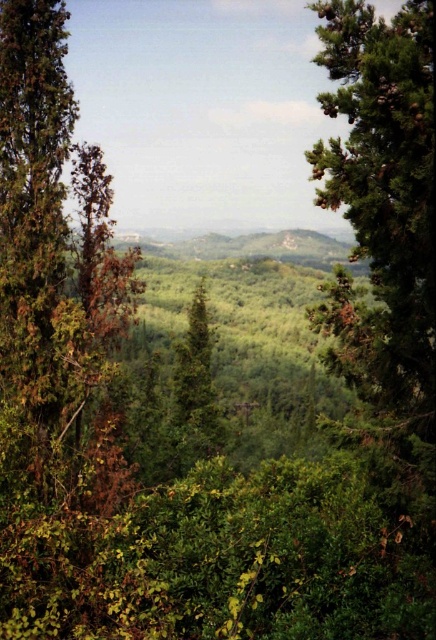
You are standing in the middle of the lush landscape and want to take a photo of both the green textured pine tree at right and the green textured tree at center. Which tree should you focus on first if you want to capture both in the same frame without moving your camera?

The green textured pine tree at right is taller than the green textured tree at center, so you should focus on the green textured pine tree at right first to ensure it fits within the frame.

You are a hiker standing on a trail and see the green textured pine tree at right and the green textured tree at center. Which tree is smaller?

The green textured pine tree at right is smaller compared to the green textured tree at center.